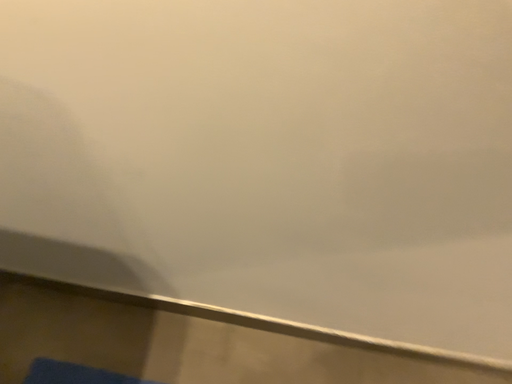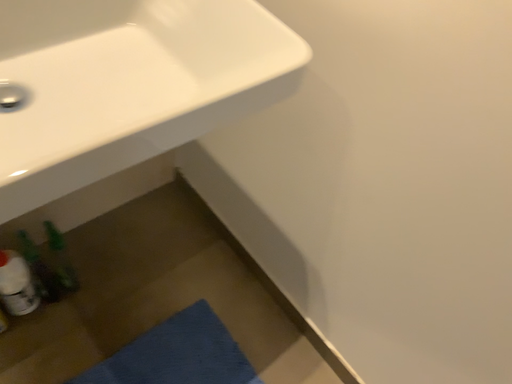
Question: Which way did the camera rotate in the video?

Choices:
 (A) rotated left
 (B) rotated right

Answer: (A)